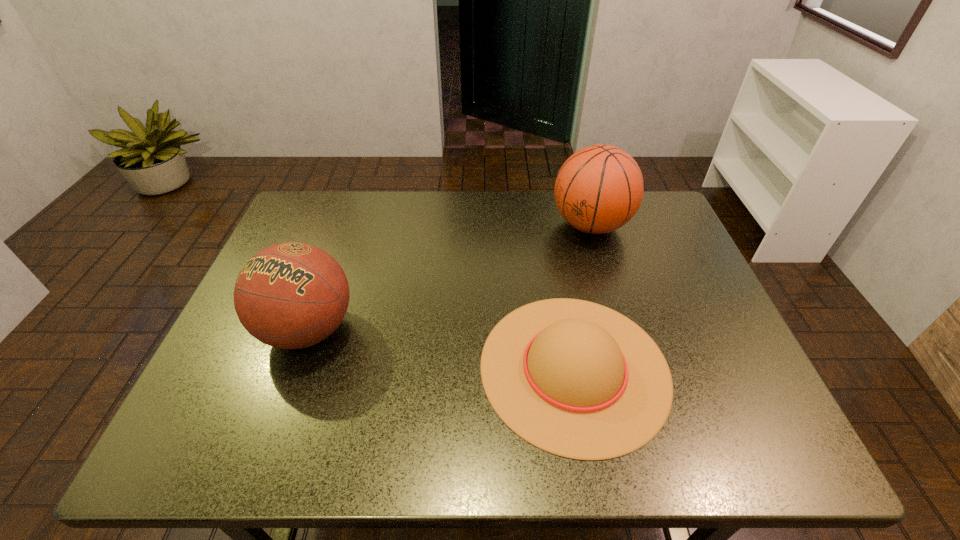
At what (x,y) coordinates should I click in order to perform the action: click on vacant space that satisfies the following two spatial constraints: 1. on the back side of the shortest object; 2. on the left side of the farthest object. Please return your answer as a coordinate pair (x, y). Image resolution: width=960 pixels, height=540 pixels. Looking at the image, I should click on (548, 225).